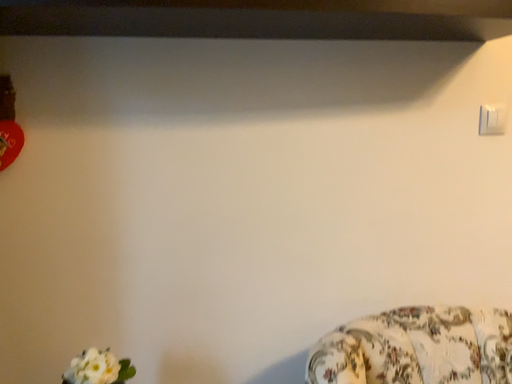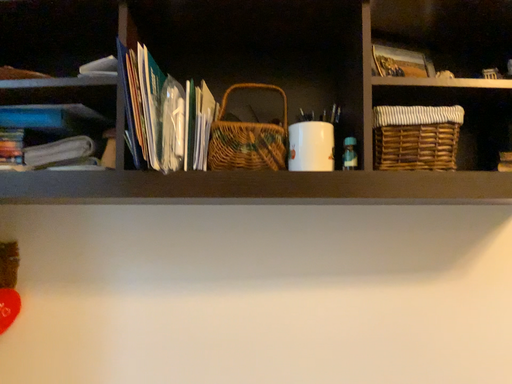
Question: Which way did the camera rotate in the video?

Choices:
 (A) rotated left
 (B) rotated right

Answer: (A)